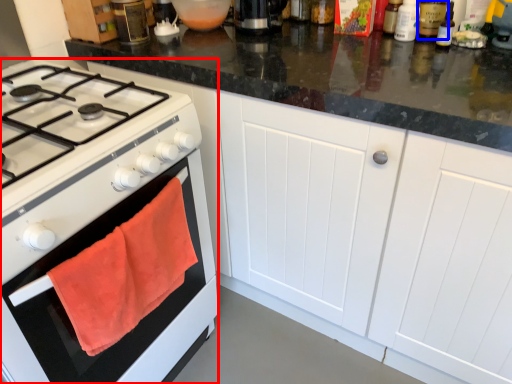
Question: Which object is closer to the camera taking this photo, gas stove (highlighted by a red box) or bottle (highlighted by a blue box)?

Choices:
 (A) gas stove
 (B) bottle

Answer: (A)